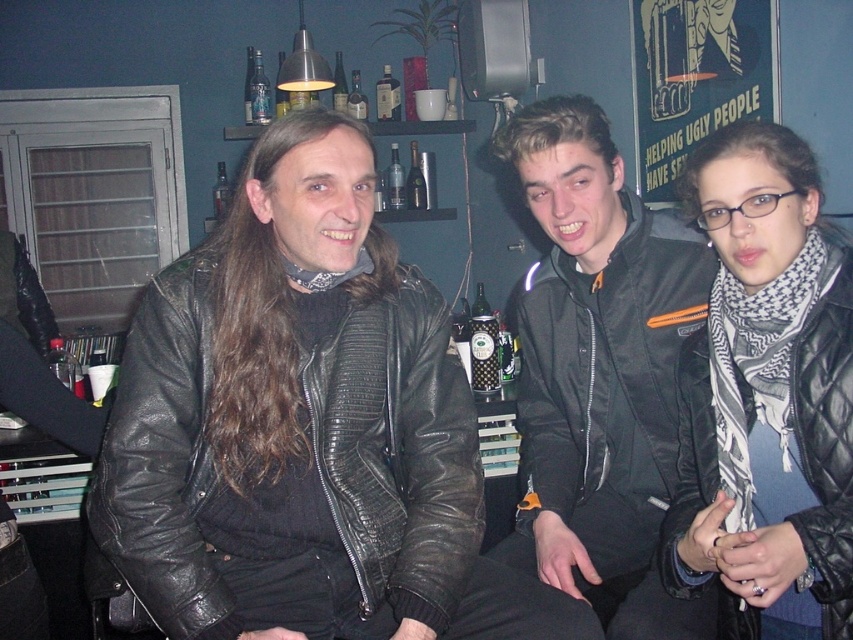
You are a photographer trying to capture a candid shot of the two people wearing jackets in the center. You notice that the black quilted jacket at center and the black leather jacket at center are positioned in a way that might block each other. Which jacket should you focus on to ensure it is fully visible in the photo?

The black quilted jacket at center is located below the black leather jacket at center, so focusing on the black leather jacket at center would ensure it is fully visible without obstruction.

You are a photographer trying to capture a group photo of the black quilted jacket at center and the black leather jacket at center. The camera you are using has a minimum focusing distance of 10 inches. Can you take a clear photo of both jackets without moving them?

The distance between the black quilted jacket at center and the black leather jacket at center is 9.97 inches, which is less than the camera minimum focusing distance of 10 inches. Therefore, you cannot take a clear photo of both jackets without moving them.